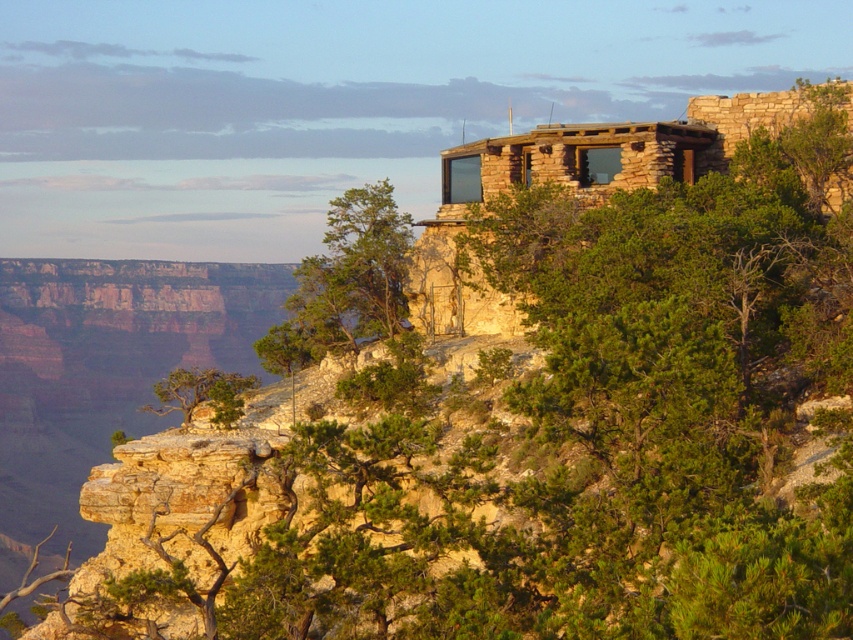
Question: Does green leafy tree at upper right have a greater width compared to green rough bark tree at center?

Choices:
 (A) no
 (B) yes

Answer: (A)

Question: Can you confirm if green leafy tree at upper right is bigger than green rough bark tree at center?

Choices:
 (A) no
 (B) yes

Answer: (A)

Question: Which of the following is the closest to the observer?

Choices:
 (A) green leafy tree at upper right
 (B) green rough bark tree at center

Answer: (B)

Question: Is green leafy tree at upper right thinner than green rough bark tree at center?

Choices:
 (A) yes
 (B) no

Answer: (A)

Question: Which point appears closest to the camera in this image?

Choices:
 (A) (402, 266)
 (B) (230, 420)

Answer: (B)